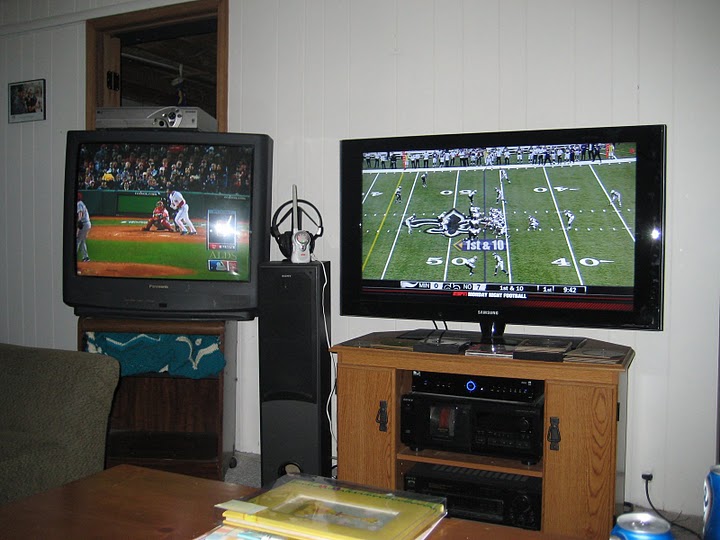
The height and width of the screenshot is (540, 720). In order to click on rolling cart in this screenshot , I will do `click(194, 449)`.